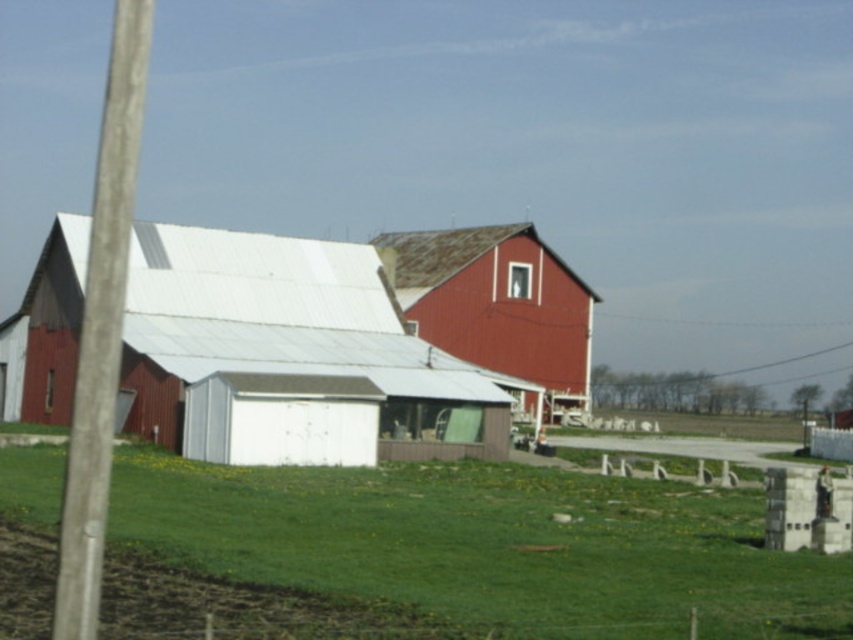
Is matte white barn at center above smooth gray pole at left?

No, matte white barn at center is not above smooth gray pole at left.

Can you confirm if matte white barn at center is smaller than smooth gray pole at left?

Yes, matte white barn at center is smaller than smooth gray pole at left.

The image size is (853, 640). Identify the location of matte white barn at center. (293, 337).

This screenshot has width=853, height=640. Identify the location of matte white barn at center. (293, 337).

Which is below, smooth red barn at center or smooth gray pole at left?

smooth red barn at center is below.

Is point (511, 323) more distant than point (99, 572)?

Yes, it is behind point (99, 572).

I want to click on smooth red barn at center, so click(497, 305).

Consider the image. Is matte white barn at center to the right of smooth red barn at center from the viewer's perspective?

In fact, matte white barn at center is to the left of smooth red barn at center.

What do you see at coordinates (293, 337) in the screenshot?
I see `matte white barn at center` at bounding box center [293, 337].

The width and height of the screenshot is (853, 640). I want to click on matte white barn at center, so click(x=293, y=337).